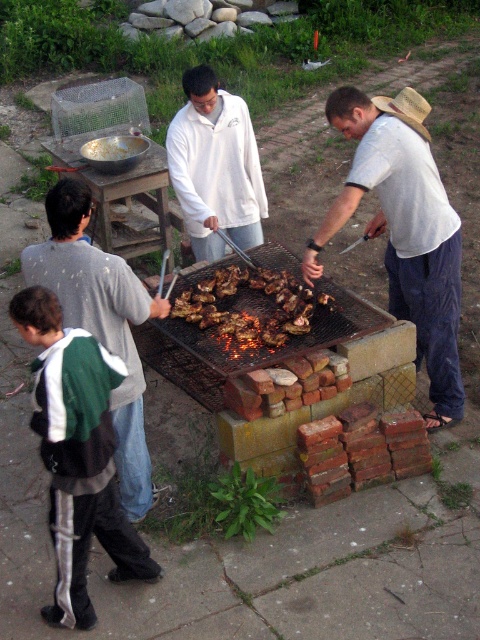
Question: Does green and white fleece jacket at lower left appear under strawmaterial/texturehat at upper right?

Choices:
 (A) no
 (B) yes

Answer: (B)

Question: Can you confirm if white matte shirt at center is smaller than grilled meat at center?

Choices:
 (A) no
 (B) yes

Answer: (A)

Question: Observing the image, what is the correct spatial positioning of white matte shirt at center in reference to grilled meat at center?

Choices:
 (A) left
 (B) right

Answer: (B)

Question: Among these objects, which one is nearest to the camera?

Choices:
 (A) white matte shirt at center
 (B) white matte sweatshirt at center
 (C) grilled meat at center

Answer: (A)

Question: Which of the following is the farthest from the observer?

Choices:
 (A) (350, 193)
 (B) (194, 314)

Answer: (B)

Question: Which object is the closest to the green and white fleece jacket at lower left?

Choices:
 (A) strawmaterial/texturehat at upper right
 (B) white matte shirt at center

Answer: (B)